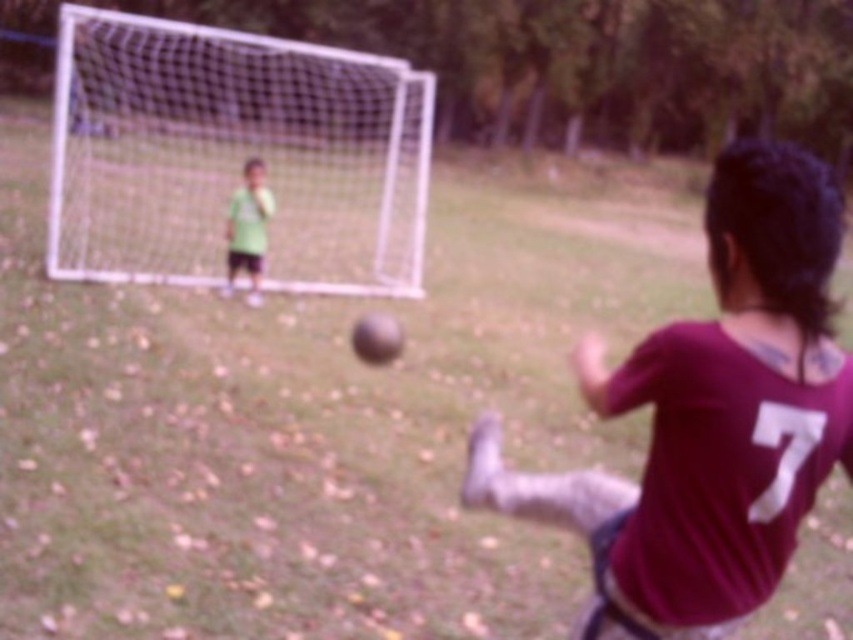
Is maroon jersey at center shorter than green matte shirt at upper left?

Yes.

Is maroon jersey at center wider than green matte shirt at upper left?

Yes.

Locate an element on the screen. This screenshot has width=853, height=640. maroon jersey at center is located at coordinates (714, 413).

The image size is (853, 640). Identify the location of maroon jersey at center. (714, 413).

Can you confirm if white mesh net at upper left is positioned to the left of green matte shirt at upper left?

Indeed, white mesh net at upper left is positioned on the left side of green matte shirt at upper left.

Does white mesh net at upper left appear over green matte shirt at upper left?

Yes, white mesh net at upper left is above green matte shirt at upper left.

Which is in front, point (300, 256) or point (262, 260)?

Point (262, 260)

This screenshot has width=853, height=640. I want to click on white mesh net at upper left, so click(234, 156).

Does maroon jersey at center have a larger size compared to white mesh net at upper left?

Actually, maroon jersey at center might be smaller than white mesh net at upper left.

Can you confirm if maroon jersey at center is taller than white mesh net at upper left?

No, maroon jersey at center is not taller than white mesh net at upper left.

Is point (824, 420) positioned before point (281, 120)?

Yes, it is in front of point (281, 120).

What are the coordinates of `maroon jersey at center` in the screenshot? It's located at (714, 413).